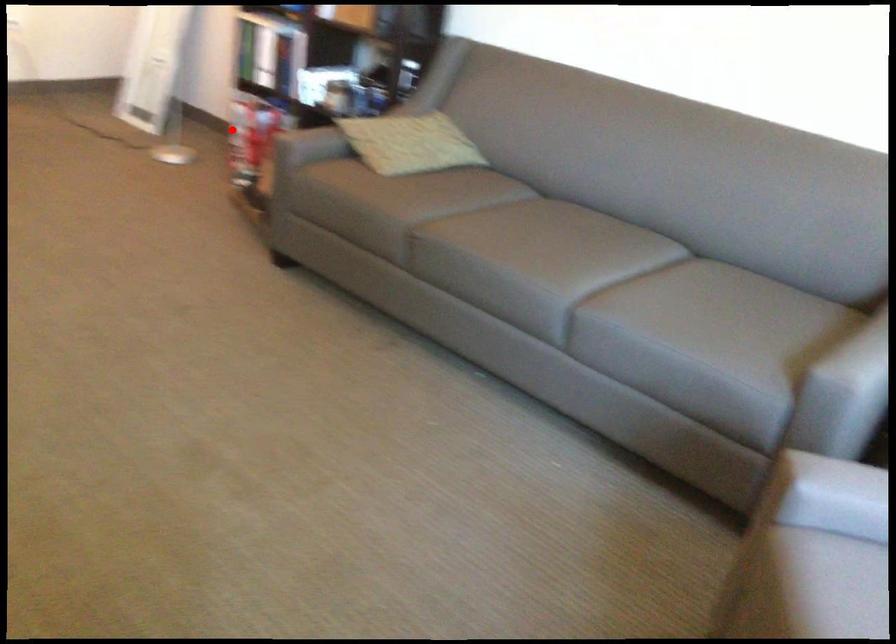
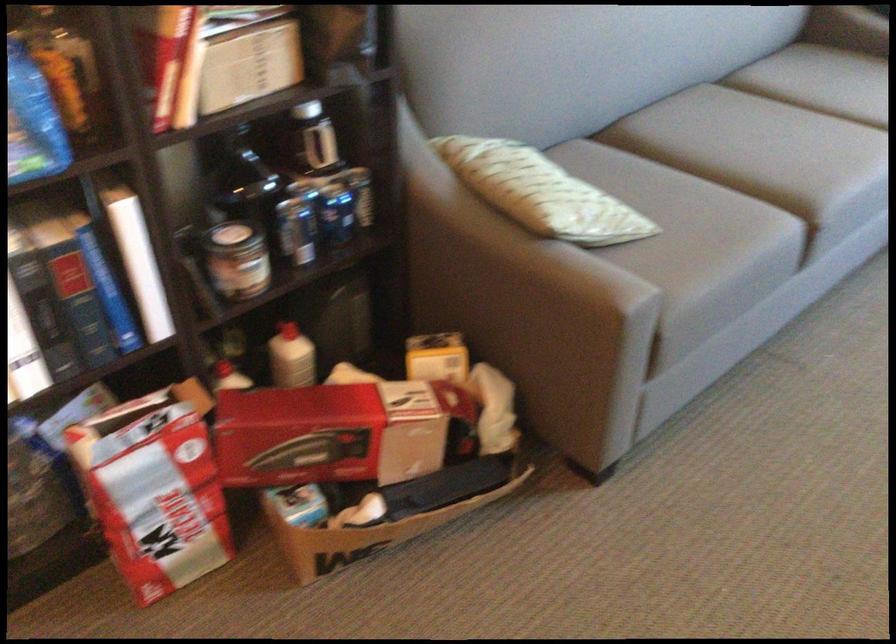
Question: I am providing you with two images of the same scene from different viewpoints. Image1 has a red point marked. In image2, the corresponding 3D location appears at what relative position? Reply with the corresponding letter.

Choices:
 (A) Closer
 (B) Farther

Answer: (A)